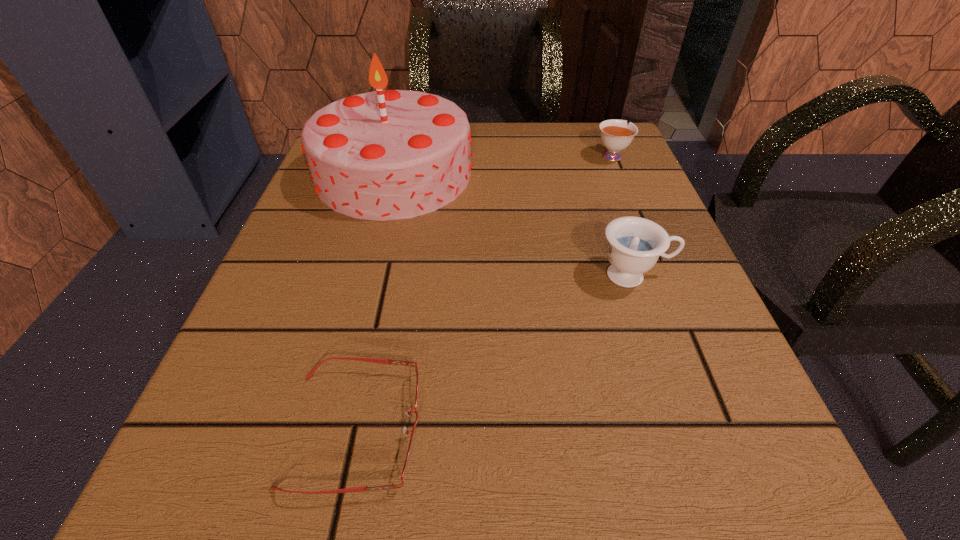
Identify the location of birthday cake present at the far edge. pyautogui.click(x=386, y=155).

This screenshot has width=960, height=540. I want to click on teacup positioned at the far edge, so pos(615,134).

You are a GUI agent. You are given a task and a screenshot of the screen. Output one action in this format:
    pyautogui.click(x=<x>, y=<y>)
    Task: Click on the object present at the near edge
    
    Given the screenshot: What is the action you would take?
    pyautogui.click(x=373, y=360)

I want to click on birthday cake located in the left edge section of the desktop, so click(386, 155).

Where is `spectacles at the left edge`? This screenshot has height=540, width=960. spectacles at the left edge is located at coordinates (373, 360).

Find the location of `object situated at the far left corner`. object situated at the far left corner is located at coordinates (386, 155).

Find the location of a particular element. The width and height of the screenshot is (960, 540). object that is at the near left corner is located at coordinates (373, 360).

What are the coordinates of `object that is at the far right corner` in the screenshot? It's located at (615, 134).

This screenshot has height=540, width=960. Identify the location of free space at the far edge. (536, 145).

You are a GUI agent. You are given a task and a screenshot of the screen. Output one action in this format:
    pyautogui.click(x=<x>, y=<y>)
    Task: Click on the free space at the left edge
    
    Given the screenshot: What is the action you would take?
    pyautogui.click(x=333, y=277)